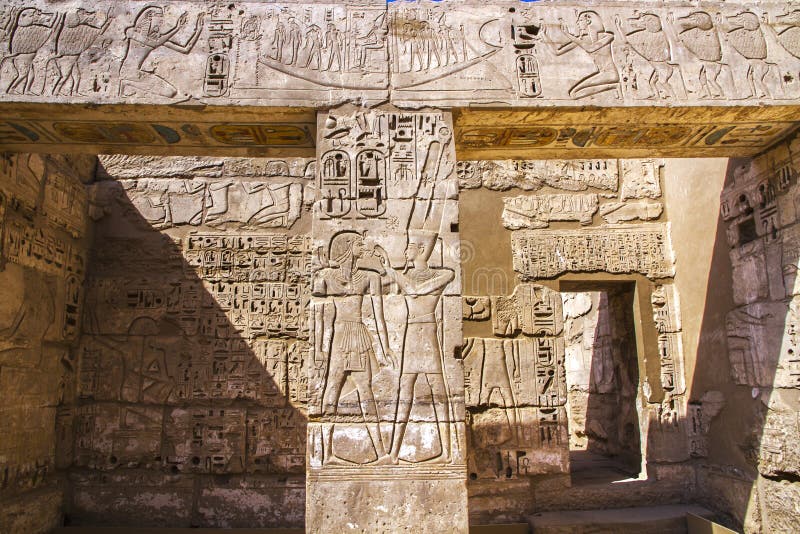
In order to click on wall in this screenshot , I will do `click(705, 204)`.